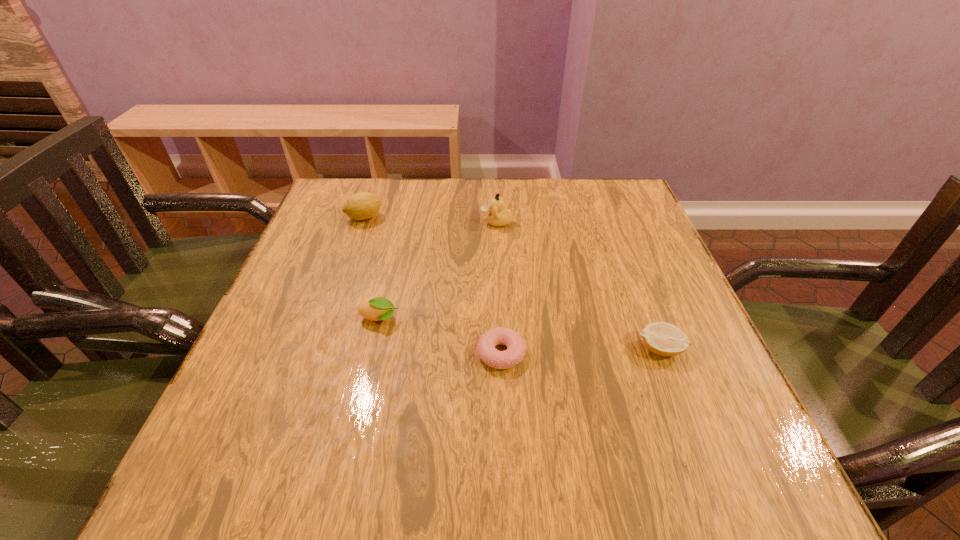
Locate an element on the screen. The width and height of the screenshot is (960, 540). duckling is located at coordinates (498, 216).

Find the location of a particular element. the fourth shortest object is located at coordinates (361, 206).

The width and height of the screenshot is (960, 540). Find the location of `the leftmost lemon`. the leftmost lemon is located at coordinates (361, 206).

Find the location of a particular element. The image size is (960, 540). the second tallest lemon is located at coordinates (376, 308).

You are a GUI agent. You are given a task and a screenshot of the screen. Output one action in this format:
    pyautogui.click(x=<x>, y=<y>)
    Task: Click on the second object from left to right
    This screenshot has height=540, width=960.
    Given the screenshot: What is the action you would take?
    pyautogui.click(x=376, y=308)

At what (x,y) coordinates should I click in order to perform the action: click on the shortest lemon. Please return your answer as a coordinate pair (x, y). Image resolution: width=960 pixels, height=540 pixels. Looking at the image, I should click on (665, 339).

At what (x,y) coordinates should I click in order to perform the action: click on the rightmost object. Please return your answer as a coordinate pair (x, y). This screenshot has width=960, height=540. Looking at the image, I should click on (665, 339).

This screenshot has width=960, height=540. Identify the location of doughnut. (515, 352).

Where is `free space located on the face of the tallest object`? This screenshot has width=960, height=540. free space located on the face of the tallest object is located at coordinates (461, 222).

Where is `vacant area situated 0.140m on the face of the tallest object`? This screenshot has width=960, height=540. vacant area situated 0.140m on the face of the tallest object is located at coordinates point(426,222).